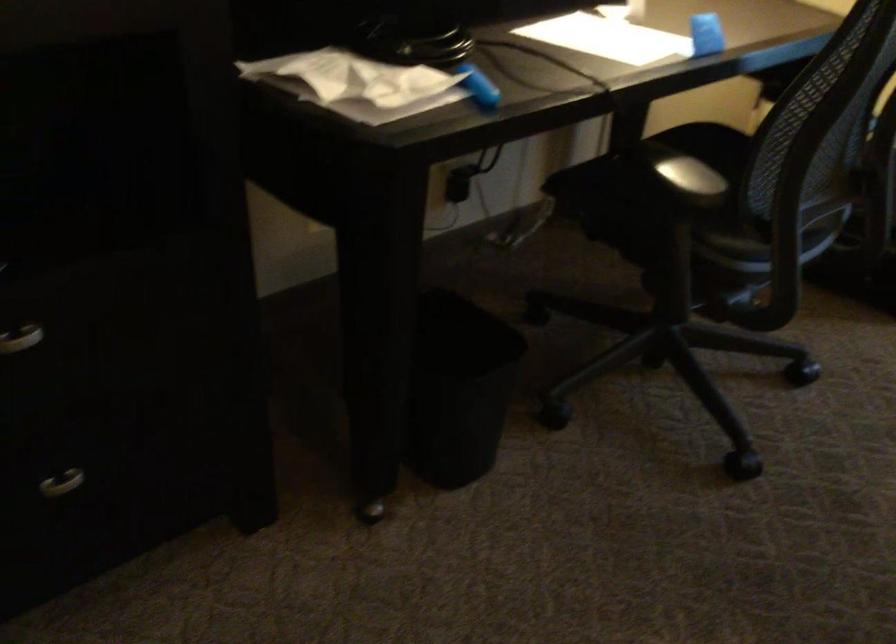
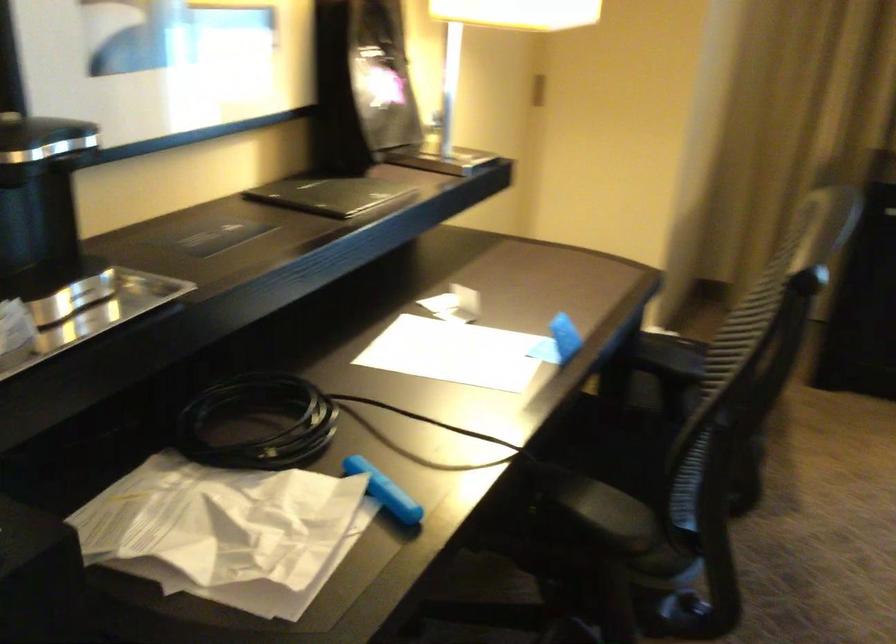
The point at (478, 80) is marked in the first image. Where is the corresponding point in the second image?

(384, 491)